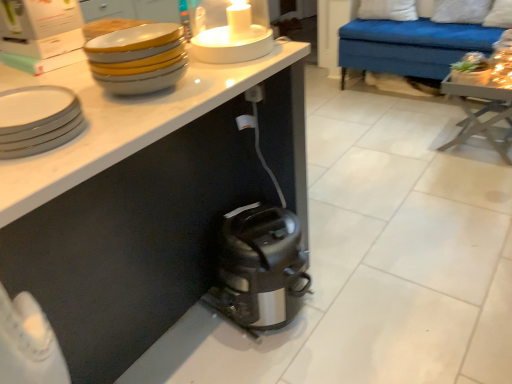
Find the location of a particular element. This screenshot has height=384, width=512. vacant space situated on the left part of wooden table at right is located at coordinates (416, 147).